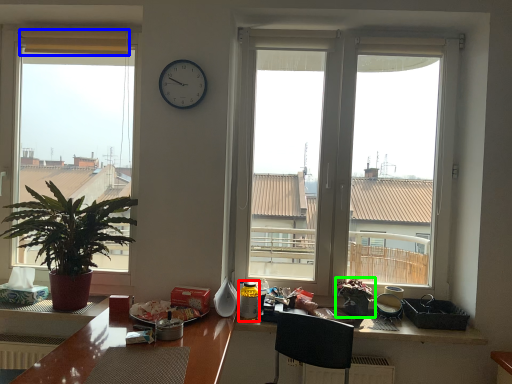
Question: Which object is the farthest from bottle (highlighted by a red box)? Choose among these: curtain (highlighted by a blue box) or houseplant (highlighted by a green box).

Choices:
 (A) curtain
 (B) houseplant

Answer: (A)